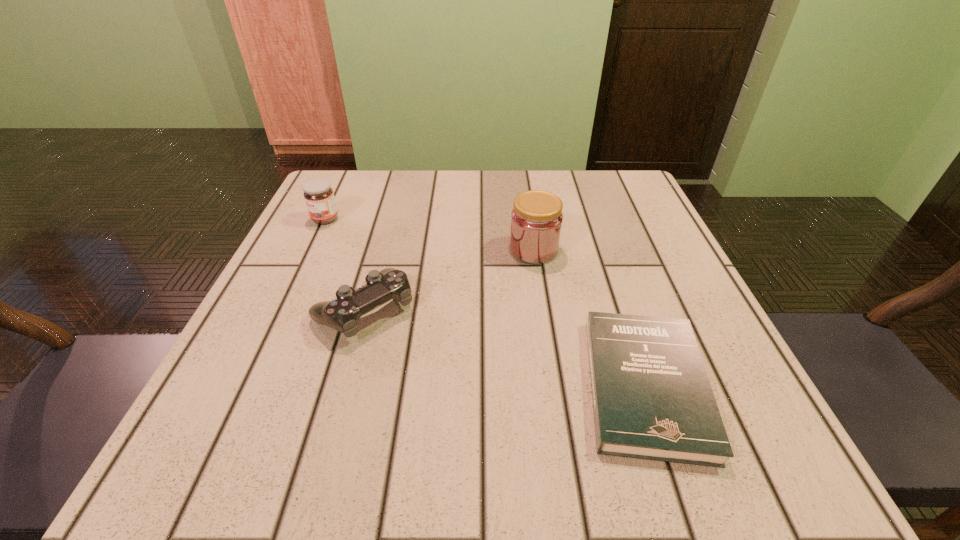
At what (x,y) coordinates should I click in order to perform the action: click on the taller jam. Please return your answer as a coordinate pair (x, y). This screenshot has width=960, height=540. Looking at the image, I should click on (536, 221).

Locate an element on the screen. The image size is (960, 540). the tallest object is located at coordinates (536, 221).

Locate an element on the screen. Image resolution: width=960 pixels, height=540 pixels. the leftmost object is located at coordinates (319, 197).

Find the location of a particular element. The width and height of the screenshot is (960, 540). the farthest object is located at coordinates (319, 197).

The width and height of the screenshot is (960, 540). I want to click on control, so click(x=342, y=314).

Where is `the third object from right to left`? This screenshot has height=540, width=960. the third object from right to left is located at coordinates tap(342, 314).

The height and width of the screenshot is (540, 960). I want to click on the shortest object, so click(652, 399).

The image size is (960, 540). Identify the location of vacant region located 0.290m on the front of the taller jam. (556, 398).

You are a GUI agent. You are given a task and a screenshot of the screen. Output one action in this format:
    pyautogui.click(x=<x>, y=<y>)
    Task: Click on the free space located 0.070m on the back of the leftmost object
    
    Given the screenshot: What is the action you would take?
    pyautogui.click(x=337, y=195)

Locate an element on the screen. vacant space located 0.070m on the left of the third object from right to left is located at coordinates (274, 310).